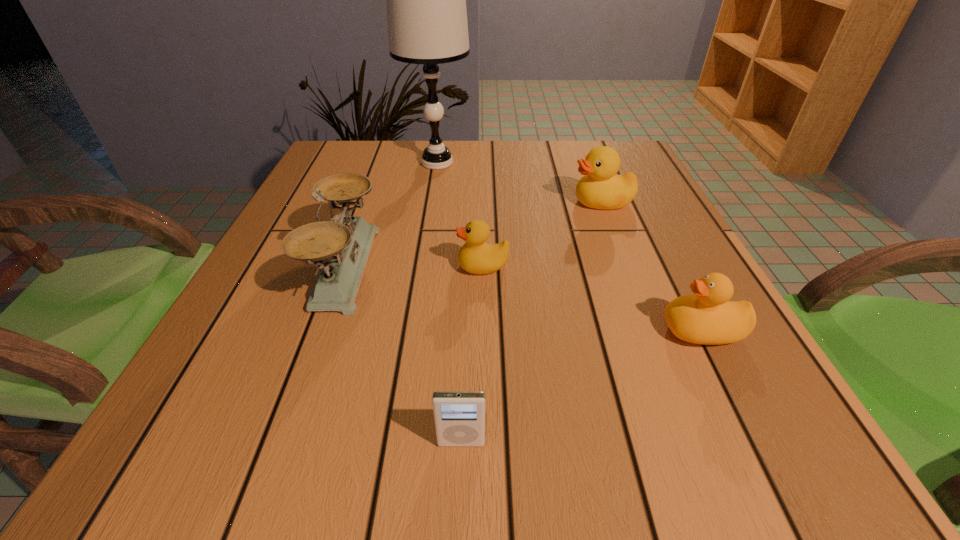
Where is `free space located 0.230m at the beak of the second farthest object`? Image resolution: width=960 pixels, height=540 pixels. free space located 0.230m at the beak of the second farthest object is located at coordinates (470, 202).

At what (x,y) coordinates should I click in order to perform the action: click on blank space located 0.090m at the beak of the second farthest object. Please return your answer as a coordinate pair (x, y). The height and width of the screenshot is (540, 960). Looking at the image, I should click on (532, 202).

Locate an element on the screen. free region located on the face of the nearest duck is located at coordinates (559, 330).

Locate an element on the screen. This screenshot has height=540, width=960. free region located 0.050m on the face of the nearest duck is located at coordinates (633, 330).

Locate an element on the screen. free space located 0.210m on the face of the nearest duck is located at coordinates (534, 330).

Locate an element on the screen. vacant position located at the beak of the second farthest duck is located at coordinates (311, 266).

The height and width of the screenshot is (540, 960). In order to click on vacant position located 0.180m at the beak of the second farthest duck in this screenshot , I will do `click(363, 266)`.

Where is `vacant space situated 0.070m at the beak of the second farthest duck`? This screenshot has height=540, width=960. vacant space situated 0.070m at the beak of the second farthest duck is located at coordinates (420, 266).

This screenshot has height=540, width=960. I want to click on object that is at the far edge, so click(426, 0).

Identify the location of object present at the near edge. (459, 416).